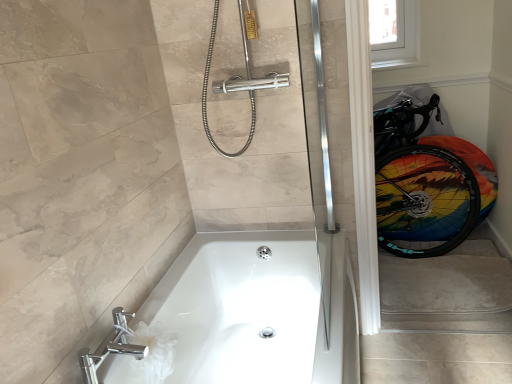
Question: Does white glossy bathtub at lower center contain transparent plastic window screen at upper right?

Choices:
 (A) yes
 (B) no

Answer: (B)

Question: Is white glossy bathtub at lower center taller than transparent plastic window screen at upper right?

Choices:
 (A) yes
 (B) no

Answer: (A)

Question: Does white glossy bathtub at lower center have a smaller size compared to transparent plastic window screen at upper right?

Choices:
 (A) no
 (B) yes

Answer: (A)

Question: From a real-world perspective, is white glossy bathtub at lower center below transparent plastic window screen at upper right?

Choices:
 (A) yes
 (B) no

Answer: (A)

Question: Is white glossy bathtub at lower center closer to camera compared to transparent plastic window screen at upper right?

Choices:
 (A) yes
 (B) no

Answer: (A)

Question: In the image, is white glossy toilet paper at lower left positioned in front of or behind rainbow painted tire at right?

Choices:
 (A) front
 (B) behind

Answer: (A)

Question: Is white glossy toilet paper at lower left to the left or to the right of rainbow painted tire at right in the image?

Choices:
 (A) left
 (B) right

Answer: (A)

Question: Is white glossy toilet paper at lower left wider or thinner than rainbow painted tire at right?

Choices:
 (A) wide
 (B) thin

Answer: (A)

Question: Based on their sizes in the image, would you say white glossy toilet paper at lower left is bigger or smaller than rainbow painted tire at right?

Choices:
 (A) small
 (B) big

Answer: (A)

Question: Is transparent plastic window screen at upper right wider or thinner than rainbow painted tire at right?

Choices:
 (A) thin
 (B) wide

Answer: (A)

Question: Choose the correct answer: Is transparent plastic window screen at upper right inside rainbow painted tire at right or outside it?

Choices:
 (A) inside
 (B) outside

Answer: (B)

Question: From the image's perspective, relative to rainbow painted tire at right, is transparent plastic window screen at upper right above or below?

Choices:
 (A) below
 (B) above

Answer: (B)

Question: Does point (386, 43) appear closer or farther from the camera than point (439, 178)?

Choices:
 (A) closer
 (B) farther

Answer: (B)

Question: Considering the positions of transparent plastic window screen at upper right and chrome/metallic faucet at lower left in the image, is transparent plastic window screen at upper right taller or shorter than chrome/metallic faucet at lower left?

Choices:
 (A) tall
 (B) short

Answer: (A)

Question: Is point (375, 56) closer or farther from the camera than point (91, 357)?

Choices:
 (A) closer
 (B) farther

Answer: (B)